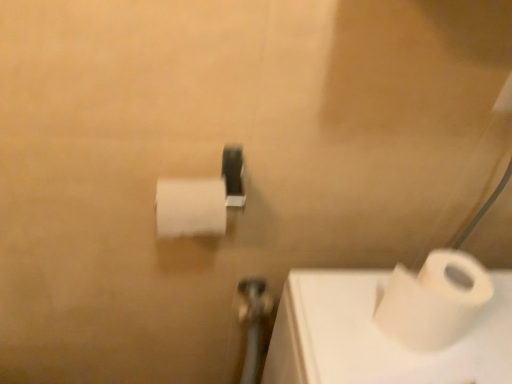
Question: From a real-world perspective, relative to white matte toilet paper at center, positioned as the 2th toilet paper in right-to-left order, is white matte toilet paper at lower right, marked as the second toilet paper in a left-to-right arrangement, vertically above or below?

Choices:
 (A) below
 (B) above

Answer: (A)

Question: Considering the positions of white matte toilet paper at lower right, marked as the second toilet paper in a left-to-right arrangement, and white matte toilet paper at center, the 1th toilet paper in the left-to-right sequence, in the image, is white matte toilet paper at lower right, marked as the second toilet paper in a left-to-right arrangement, taller or shorter than white matte toilet paper at center, the 1th toilet paper in the left-to-right sequence,?

Choices:
 (A) tall
 (B) short

Answer: (A)

Question: Based on their relative distances, which object is nearer to the metallic silver shower at center?

Choices:
 (A) white matte toilet paper at lower right, which is the 1th toilet paper from right to left
 (B) white matte toilet paper at center, positioned as the 2th toilet paper in right-to-left order

Answer: (B)

Question: Estimate the real-world distances between objects in this image. Which object is closer to the white matte toilet paper at lower right, acting as the second toilet paper starting from the top?

Choices:
 (A) white matte toilet paper at center, positioned as the 2th toilet paper in bottom-to-top order
 (B) metallic silver shower at center

Answer: (A)